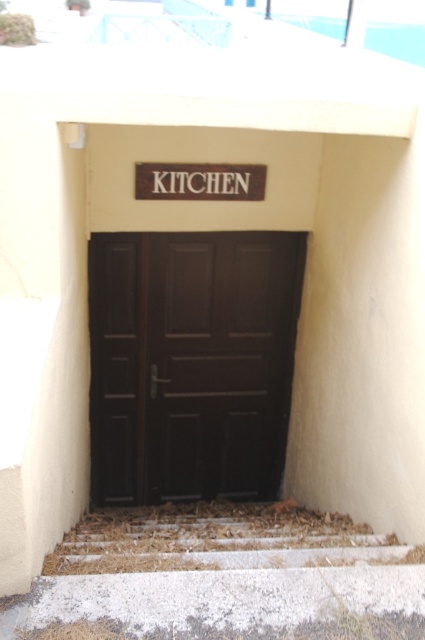
Question: Does matte dark brown door at center appear on the right side of brown wooden sign at center?

Choices:
 (A) no
 (B) yes

Answer: (A)

Question: Is matte dark brown door at center below brown wooden sign at center?

Choices:
 (A) yes
 (B) no

Answer: (A)

Question: Which point appears farthest from the camera in this image?

Choices:
 (A) (227, 362)
 (B) (249, 192)
 (C) (173, 502)

Answer: (C)

Question: Does matte dark brown door at center appear over brown wooden stairs at lower center?

Choices:
 (A) no
 (B) yes

Answer: (B)

Question: Which of the following is the closest to the observer?

Choices:
 (A) brown wooden stairs at lower center
 (B) matte dark brown door at center

Answer: (A)

Question: Which object is positioned closest to the brown wooden sign at center?

Choices:
 (A) matte dark brown door at center
 (B) brown wooden stairs at lower center

Answer: (A)